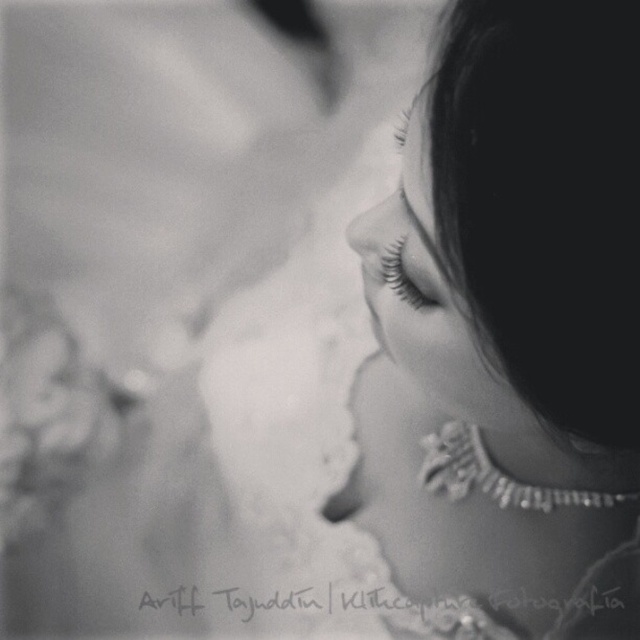
Can you confirm if pearl necklace at upper right is wider than smooth skin at upper right?

Yes.

Measure the distance from pearl necklace at upper right to smooth skin at upper right.

pearl necklace at upper right is 5.39 centimeters from smooth skin at upper right.

Who is more forward, (490, 353) or (499, 426)?

Point (490, 353)

Where is `pearl necklace at upper right`? The image size is (640, 640). pearl necklace at upper right is located at coordinates (509, 330).

Is pearl necklace at upper right below black eyelashes at center?

Indeed, pearl necklace at upper right is positioned under black eyelashes at center.

Does pearl necklace at upper right lie in front of black eyelashes at center?

Yes, pearl necklace at upper right is in front of black eyelashes at center.

Does point (394, 548) lie in front of point (384, 276)?

No.

At what (x,y) coordinates should I click in order to perform the action: click on pearl necklace at upper right. Please return your answer as a coordinate pair (x, y). This screenshot has height=640, width=640. Looking at the image, I should click on (509, 330).

Can you confirm if smooth skin at upper right is wider than black eyelashes at center?

Correct, the width of smooth skin at upper right exceeds that of black eyelashes at center.

Which is above, smooth skin at upper right or black eyelashes at center?

Positioned higher is smooth skin at upper right.

Describe the element at coordinates (428, 298) in the screenshot. Image resolution: width=640 pixels, height=640 pixels. I see `smooth skin at upper right` at that location.

In order to click on smooth skin at upper right in this screenshot , I will do pos(428,298).